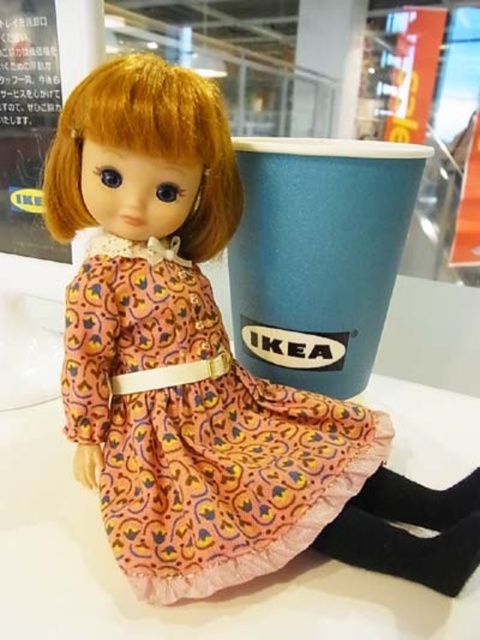
Question: Can you confirm if printed fabric dress at center is bigger than blue paper cup at upper center?

Choices:
 (A) yes
 (B) no

Answer: (B)

Question: Among these points, which one is farthest from the camera?

Choices:
 (A) (251, 189)
 (B) (220, 486)

Answer: (A)

Question: Is printed fabric dress at center thinner than blue paper cup at upper center?

Choices:
 (A) yes
 (B) no

Answer: (B)

Question: Which point appears closest to the camera in this image?

Choices:
 (A) (266, 336)
 (B) (282, 480)

Answer: (B)

Question: Which point appears closest to the camera in this image?

Choices:
 (A) (324, 198)
 (B) (166, 486)

Answer: (B)

Question: Does printed fabric dress at center have a smaller size compared to blue paper cup at upper center?

Choices:
 (A) no
 (B) yes

Answer: (B)